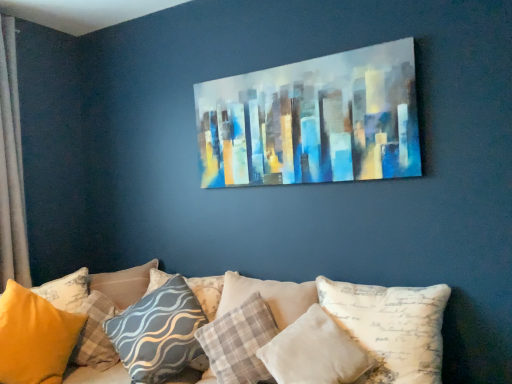
Question: Considering the relative sizes of silky beige curtain at left and gray wavy-patterned pillow at center, the 4th pillow when ordered from left to right, in the image provided, is silky beige curtain at left thinner than gray wavy-patterned pillow at center, the 4th pillow when ordered from left to right,?

Choices:
 (A) yes
 (B) no

Answer: (A)

Question: Is silky beige curtain at left further to the viewer compared to gray wavy-patterned pillow at center, the 4th pillow from the right?

Choices:
 (A) yes
 (B) no

Answer: (A)

Question: Is gray wavy-patterned pillow at center, the 4th pillow from the right, completely or partially inside silky beige curtain at left?

Choices:
 (A) no
 (B) yes

Answer: (A)

Question: Is silky beige curtain at left shorter than gray wavy-patterned pillow at center, the 4th pillow when ordered from left to right?

Choices:
 (A) no
 (B) yes

Answer: (A)

Question: Is the position of silky beige curtain at left less distant than that of gray wavy-patterned pillow at center, the 4th pillow from the right?

Choices:
 (A) no
 (B) yes

Answer: (A)

Question: Choose the correct answer: Is white velvety pillow at center, the second pillow when ordered from right to left, inside silky beige curtain at left or outside it?

Choices:
 (A) outside
 (B) inside

Answer: (A)

Question: Considering the positions of point (359, 367) and point (10, 36), is point (359, 367) closer or farther from the camera than point (10, 36)?

Choices:
 (A) closer
 (B) farther

Answer: (A)

Question: From the image's perspective, relative to silky beige curtain at left, is white velvety pillow at center, arranged as the 6th pillow when viewed from the left, above or below?

Choices:
 (A) above
 (B) below

Answer: (B)

Question: Considering the positions of white velvety pillow at center, the second pillow when ordered from right to left, and silky beige curtain at left in the image, is white velvety pillow at center, the second pillow when ordered from right to left, bigger or smaller than silky beige curtain at left?

Choices:
 (A) small
 (B) big

Answer: (A)

Question: From the image's perspective, is white fabric pillow at center, which is the first pillow from right to left, located above or below white velvety pillow at center, the second pillow when ordered from right to left?

Choices:
 (A) above
 (B) below

Answer: (A)

Question: Is white fabric pillow at center, which is the first pillow from right to left, to the left or to the right of white velvety pillow at center, arranged as the 6th pillow when viewed from the left, in the image?

Choices:
 (A) right
 (B) left

Answer: (A)

Question: Is white fabric pillow at center, which is the first pillow from right to left, wider or thinner than white velvety pillow at center, the second pillow when ordered from right to left?

Choices:
 (A) wide
 (B) thin

Answer: (A)

Question: Is white fabric pillow at center, the seventh pillow viewed from the left, situated inside white velvety pillow at center, arranged as the 6th pillow when viewed from the left, or outside?

Choices:
 (A) outside
 (B) inside

Answer: (A)

Question: Is white velvety pillow at center, arranged as the 6th pillow when viewed from the left, spatially inside matte yellow pillow at lower left, acting as the seventh pillow starting from the right, or outside of it?

Choices:
 (A) outside
 (B) inside

Answer: (A)

Question: From the image's perspective, is white velvety pillow at center, arranged as the 6th pillow when viewed from the left, above or below matte yellow pillow at lower left, acting as the seventh pillow starting from the right?

Choices:
 (A) below
 (B) above

Answer: (B)